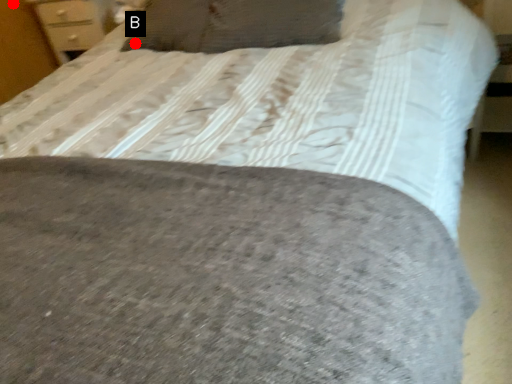
Question: Two points are circled on the image, labeled by A and B beside each circle. Which point appears farthest from the camera in this image?

Choices:
 (A) A is further
 (B) B is further

Answer: (A)